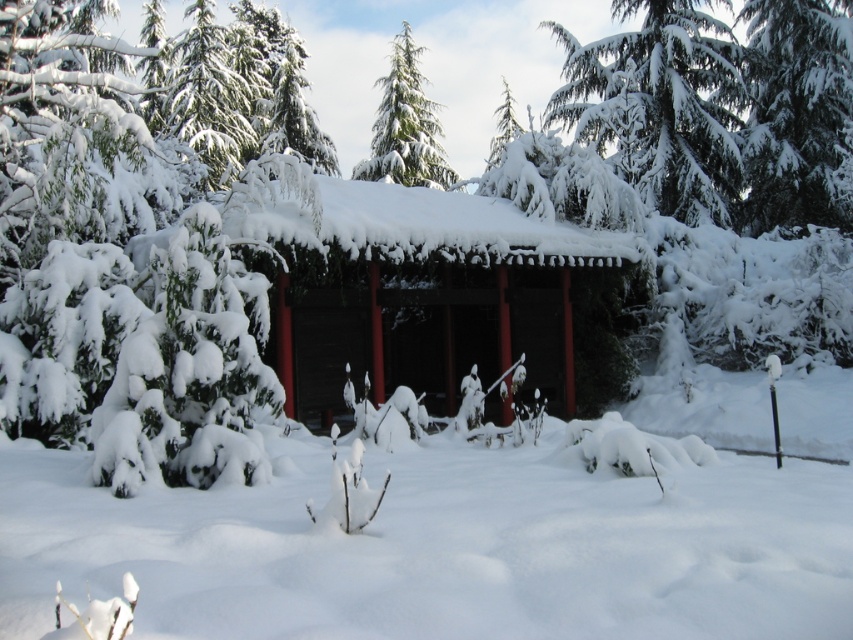
Is smooth wooden cabin at center wider than green textured pine tree at center?

Correct, the width of smooth wooden cabin at center exceeds that of green textured pine tree at center.

Can you confirm if smooth wooden cabin at center is positioned to the right of green textured pine tree at center?

Yes, smooth wooden cabin at center is to the right of green textured pine tree at center.

Locate an element on the screen. This screenshot has width=853, height=640. smooth wooden cabin at center is located at coordinates (422, 291).

Measure the distance between white fluffy snow at center and green textured pine tree at center.

white fluffy snow at center is 81.70 feet from green textured pine tree at center.

Does white fluffy snow at center have a smaller size compared to green textured pine tree at center?

Yes.

Is point (668, 516) closer to viewer compared to point (403, 104)?

That is True.

Image resolution: width=853 pixels, height=640 pixels. In order to click on white fluffy snow at center in this screenshot , I will do `click(442, 547)`.

The image size is (853, 640). Identify the location of white fluffy snow at center. (442, 547).

Is point (602, 548) closer to camera compared to point (570, 246)?

Yes.

Which is in front, point (756, 490) or point (374, 301)?

Positioned in front is point (756, 490).

You are a GUI agent. You are given a task and a screenshot of the screen. Output one action in this format:
    pyautogui.click(x=<x>, y=<y>)
    Task: Click on the white fluffy snow at center
    This screenshot has height=640, width=853.
    Given the screenshot: What is the action you would take?
    pyautogui.click(x=442, y=547)